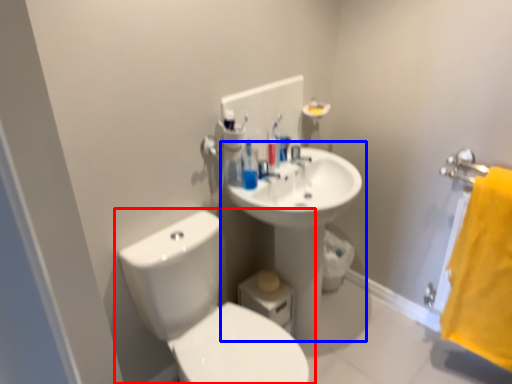
Question: Which of the following is the farthest to the observer, toilet (highlighted by a red box) or sink (highlighted by a blue box)?

Choices:
 (A) toilet
 (B) sink

Answer: (B)